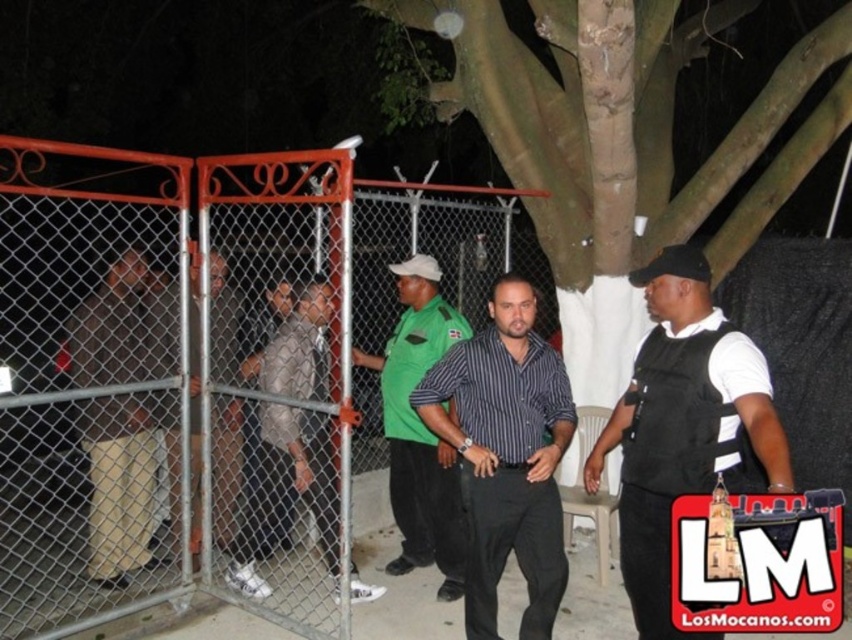
From the picture: You are at the event and want to greet both the person in the striped cotton shirt at center and the person in the light brown leather jacket at center. Which one should you approach first if you want to start with the one on the left?

You should approach the light brown leather jacket at center first because the striped cotton shirt at center is to the right of it.